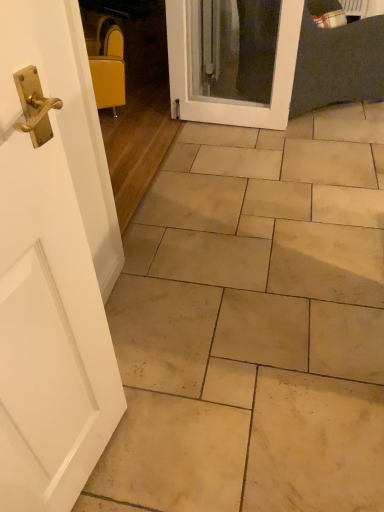
Question: From the image's perspective, is white glossy door at center under yellow fabric chair at upper left?

Choices:
 (A) yes
 (B) no

Answer: (A)

Question: Could yellow fabric chair at upper left be considered to be inside white glossy door at center?

Choices:
 (A) no
 (B) yes

Answer: (A)

Question: Is white glossy door at center not near yellow fabric chair at upper left?

Choices:
 (A) yes
 (B) no

Answer: (B)

Question: From a real-world perspective, is white glossy door at center below yellow fabric chair at upper left?

Choices:
 (A) yes
 (B) no

Answer: (B)

Question: Does white glossy door at center have a greater width compared to yellow fabric chair at upper left?

Choices:
 (A) yes
 (B) no

Answer: (B)

Question: Does point (112, 84) appear closer or farther from the camera than point (190, 105)?

Choices:
 (A) closer
 (B) farther

Answer: (A)

Question: In terms of width, does yellow fabric chair at upper left look wider or thinner when compared to white glossy door at center?

Choices:
 (A) thin
 (B) wide

Answer: (B)

Question: Considering their positions, is yellow fabric chair at upper left located in front of or behind white glossy door at center?

Choices:
 (A) behind
 (B) front

Answer: (A)

Question: Visually, is yellow fabric chair at upper left positioned to the left or to the right of white glossy door at center?

Choices:
 (A) right
 (B) left

Answer: (B)

Question: In the image, is beige stone tile at center on the left side or the right side of white glossy door at center?

Choices:
 (A) left
 (B) right

Answer: (B)

Question: Considering their positions, is beige stone tile at center located in front of or behind white glossy door at center?

Choices:
 (A) behind
 (B) front

Answer: (B)

Question: Which is correct: beige stone tile at center is inside white glossy door at center, or outside of it?

Choices:
 (A) inside
 (B) outside

Answer: (B)

Question: From their relative heights in the image, would you say beige stone tile at center is taller or shorter than white glossy door at center?

Choices:
 (A) short
 (B) tall

Answer: (A)

Question: Is white glossy door at center to the left or to the right of beige stone tile at center in the image?

Choices:
 (A) left
 (B) right

Answer: (A)

Question: Is white glossy door at center inside or outside of beige stone tile at center?

Choices:
 (A) outside
 (B) inside

Answer: (A)